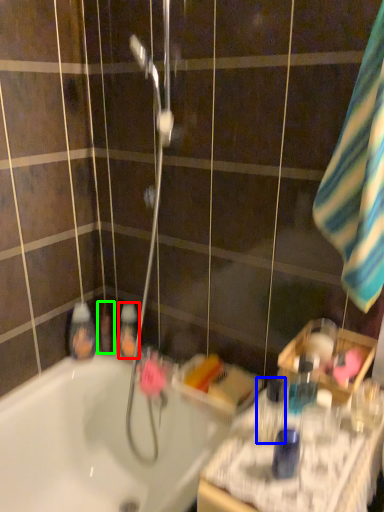
Question: Based on their relative distances, which object is nearer to mouthwash (highlighted by a red box)? Choose from mouthwash (highlighted by a blue box) and mouthwash (highlighted by a green box).

Choices:
 (A) mouthwash
 (B) mouthwash

Answer: (B)